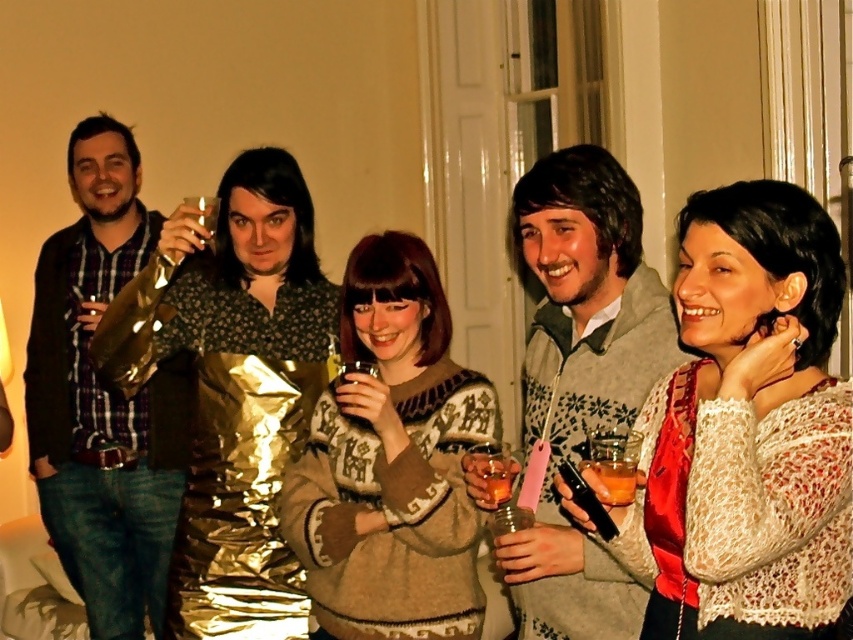
Consider the image. You are planning to take a photo of the matte black shirt at left and the gray sweater at center. Which one should you focus on first if you want to capture both in a single frame without moving the camera?

You should focus on the matte black shirt at left first because it is taller than the gray sweater at center, so it will require adjusting the camera angle to include its full height while still capturing the gray sweater at center.

You are a photographer trying to capture the scene from the perspective of someone standing in front of the door. You want to ensure both the knitted beige sweater at center and the translucent amber glass at lower right are visible in your shot. Based on their positions, which object will appear higher in the photo?

The knitted beige sweater at center appears higher in the photo because it is positioned above the translucent amber glass at lower right.

You are a photographer setting up a shoot in the room. You need to position a spotlight so that it illuminates the knitted beige sweater at center without casting a shadow on the matte black shirt at left. Is this possible given their positions?

The knitted beige sweater at center is in front of the matte black shirt at left. Since the sweater is in front, placing the spotlight behind the sweater would cast its shadow onto the shirt, making it impossible to avoid the shadow. Alternatively, positioning the light source directly in front would illuminate the sweater while minimizing shadow on the shirt, but the shadow might still fall on the shirt depending on angle. However, given their spatial arrangement, it is not possible to completely eliminate